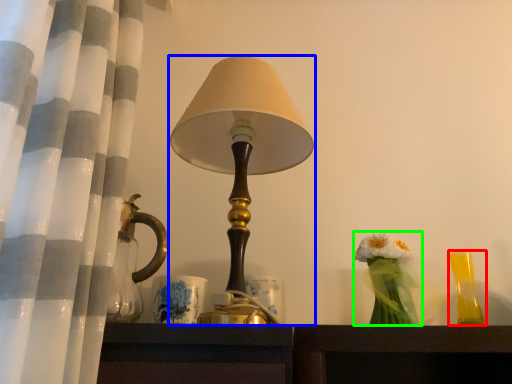
Question: Which object is the closest to the candle holder (highlighted by a red box)? Choose among these: lamp (highlighted by a blue box) or floral arrangement (highlighted by a green box).

Choices:
 (A) lamp
 (B) floral arrangement

Answer: (B)